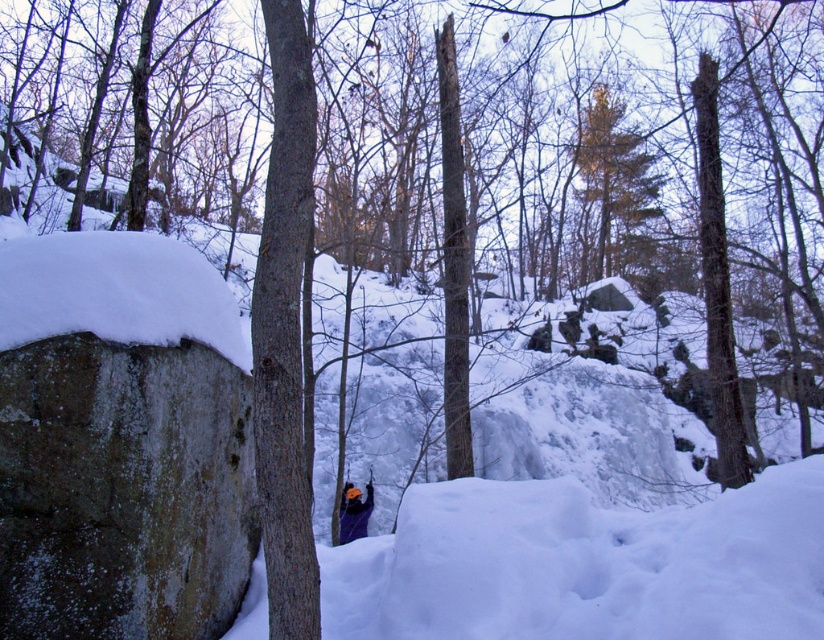
Question: Which point appears farthest from the camera in this image?

Choices:
 (A) (76, 608)
 (B) (609, 120)
 (C) (354, 528)

Answer: (B)

Question: Observing the image, what is the correct spatial positioning of speckled stone boulder at left in reference to orange helmet at center?

Choices:
 (A) right
 (B) left

Answer: (B)

Question: Which point appears closest to the camera in this image?

Choices:
 (A) (357, 529)
 (B) (602, 272)

Answer: (A)

Question: Does brown textured tree at upper center have a larger size compared to orange helmet at center?

Choices:
 (A) no
 (B) yes

Answer: (B)

Question: Observing the image, what is the correct spatial positioning of speckled stone boulder at left in reference to brown textured tree at upper center?

Choices:
 (A) below
 (B) above

Answer: (A)

Question: Which object appears farthest from the camera in this image?

Choices:
 (A) orange helmet at center
 (B) brown textured tree at upper center

Answer: (B)